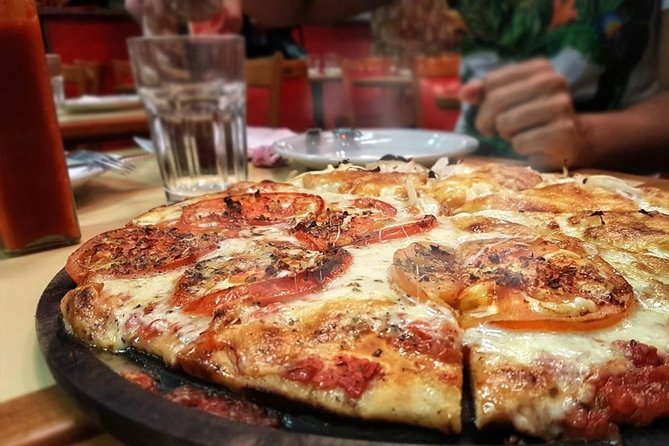
Find the location of a particular element. Image resolution: width=669 pixels, height=446 pixels. glass is located at coordinates (193, 62).